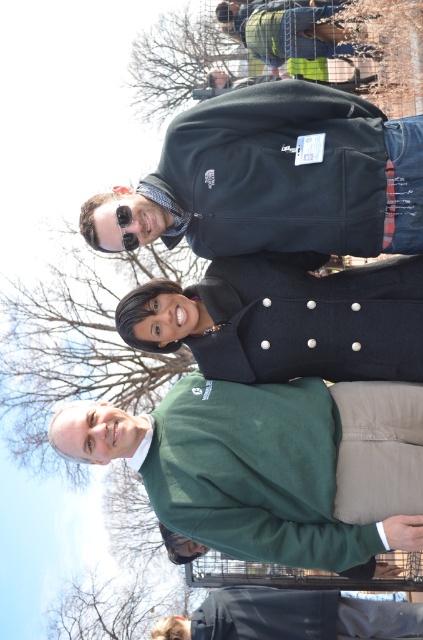
You are standing in front of the group of four people in the image. There are two points marked on the image at coordinates point (153, 417) and point (117, 189). If you want to touch both points with your finger, which point should you reach for first?

You should reach for point (117, 189) first because it is closer to you than point (153, 417), which is further away.

You are a photographer trying to capture a closeup of the black matte sunglasses at upper center without including the green fleece sweater at center in the frame. Given their relative sizes, is this possible?

The green fleece sweater at center has a lesser width compared to the black matte sunglasses at upper center. Therefore, it is possible to capture a closeup of the black matte sunglasses at upper center without including the green fleece sweater at center in the frame since the sweater is narrower.